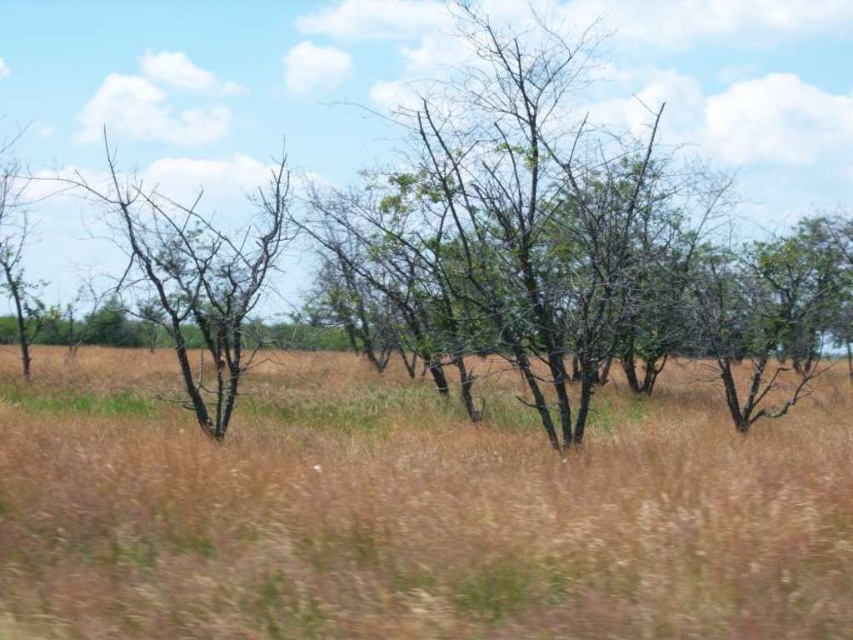
What do you see at coordinates (410, 509) in the screenshot?
I see `brown grass at center` at bounding box center [410, 509].

Where is `brown grass at center`? The image size is (853, 640). brown grass at center is located at coordinates (410, 509).

I want to click on brown grass at center, so click(x=410, y=509).